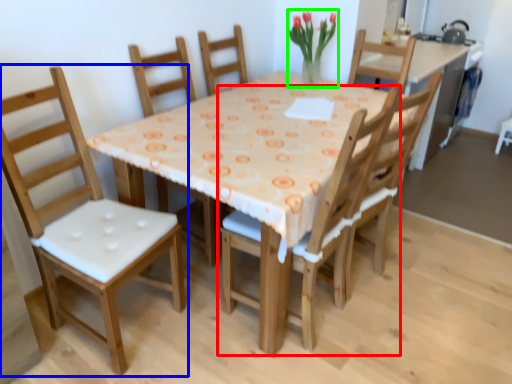
Question: Which object is positioned closest to chair (highlighted by a red box)? Select from chair (highlighted by a blue box) and floral arrangement (highlighted by a green box).

Choices:
 (A) chair
 (B) floral arrangement

Answer: (A)